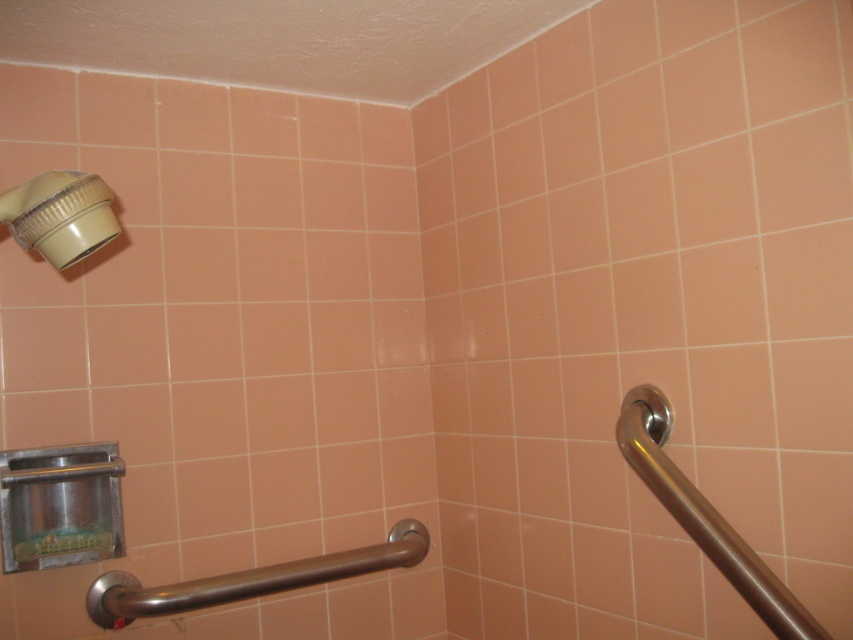
Does polished stainless steel grab bar at right have a greater height compared to satin nickel grab bar at lower center?

Yes.

Which is above, polished stainless steel grab bar at right or satin nickel grab bar at lower center?

Positioned higher is polished stainless steel grab bar at right.

Is point (776, 595) positioned behind point (331, 563)?

No, (776, 595) is closer to viewer.

Locate an element on the screen. This screenshot has width=853, height=640. polished stainless steel grab bar at right is located at coordinates (704, 516).

Does polished stainless steel grab bar at right appear on the right side of matte white showerhead at upper left?

Yes, polished stainless steel grab bar at right is to the right of matte white showerhead at upper left.

Which is in front, point (671, 515) or point (80, 243)?

Point (671, 515) is more forward.

The height and width of the screenshot is (640, 853). In order to click on polished stainless steel grab bar at right in this screenshot , I will do `click(704, 516)`.

Between satin nickel grab bar at lower center and matte white showerhead at upper left, which one appears on the right side from the viewer's perspective?

From the viewer's perspective, satin nickel grab bar at lower center appears more on the right side.

Is point (372, 557) positioned behind point (59, 236)?

Yes, it is behind point (59, 236).

Which is behind, point (227, 595) or point (71, 252)?

Positioned behind is point (227, 595).

Find the location of a particular element. satin nickel grab bar at lower center is located at coordinates (x=248, y=579).